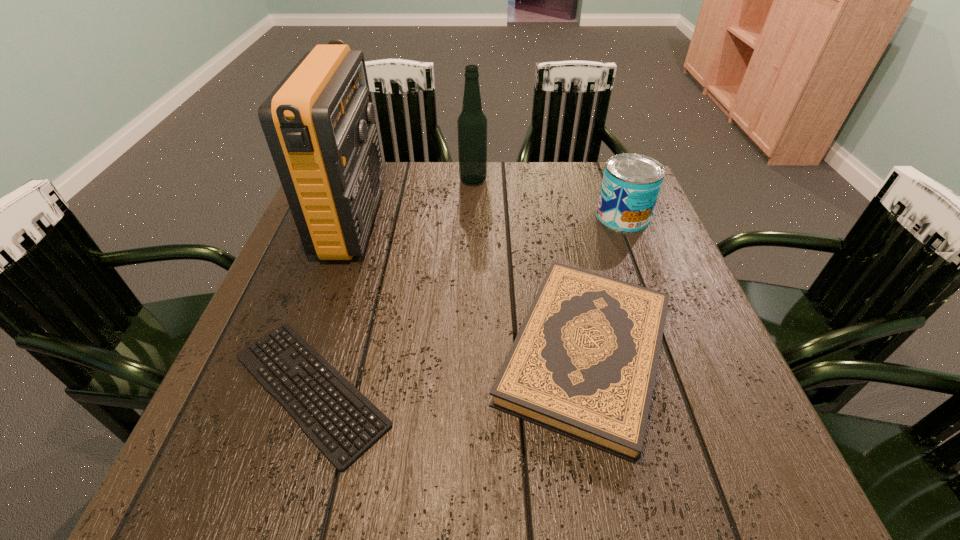
Where is `radio receiver positioned at the far edge`? radio receiver positioned at the far edge is located at coordinates (318, 122).

Find the location of `alcohol positioned at the far edge`. alcohol positioned at the far edge is located at coordinates (472, 123).

Where is `can present at the far edge`? Image resolution: width=960 pixels, height=540 pixels. can present at the far edge is located at coordinates (631, 183).

Find the location of a particular element. The height and width of the screenshot is (540, 960). hardback book present at the near edge is located at coordinates (583, 364).

Find the location of `computer keyboard positioned at the near edge`. computer keyboard positioned at the near edge is located at coordinates (284, 360).

The width and height of the screenshot is (960, 540). I want to click on radio receiver positioned at the left edge, so click(318, 122).

The height and width of the screenshot is (540, 960). I want to click on computer keyboard located at the left edge, so click(x=284, y=360).

Locate an element on the screen. The height and width of the screenshot is (540, 960). can present at the right edge is located at coordinates (631, 183).

I want to click on hardback book present at the right edge, so click(583, 364).

Find the location of a particular element. object that is at the far left corner is located at coordinates (318, 122).